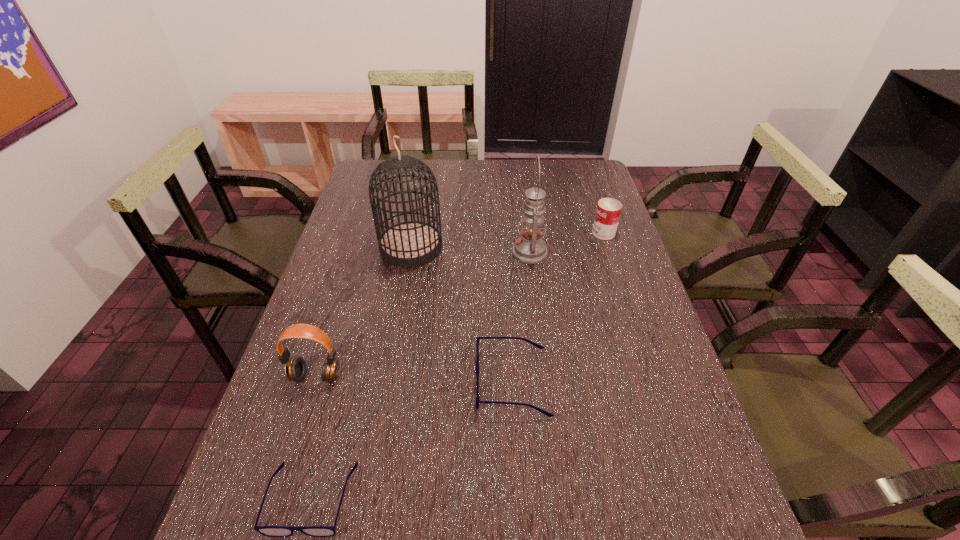
Find the location of a particular element. This screenshot has width=960, height=540. free space between the nearest object and the birdcage is located at coordinates (362, 373).

Find the location of `unoccupied area between the oil lamp and the birdcage`. unoccupied area between the oil lamp and the birdcage is located at coordinates (470, 249).

This screenshot has width=960, height=540. In order to click on unoccupied area between the headset and the oil lamp in this screenshot , I will do click(422, 314).

Identify the location of free space that is in between the can and the oil lamp. Image resolution: width=960 pixels, height=540 pixels. (566, 242).

At what (x,y) coordinates should I click in order to perform the action: click on vacant area that lies between the fourth tallest object and the nearer spectacles. Please return your answer as a coordinate pair (x, y). Looking at the image, I should click on (458, 366).

You are a GUI agent. You are given a task and a screenshot of the screen. Output one action in this format:
    pyautogui.click(x=<x>, y=<y>)
    Task: Click on the free space between the right spectacles and the oil lamp
    The height and width of the screenshot is (540, 960).
    Given the screenshot: What is the action you would take?
    pyautogui.click(x=521, y=317)

Image resolution: width=960 pixels, height=540 pixels. I want to click on vacant area that lies between the fourth shortest object and the second shortest object, so click(x=414, y=379).

Identify the location of vacant region between the second shortest object and the shorter spectacles. (412, 441).

You are a GUI agent. You are given a task and a screenshot of the screen. Output one action in this format:
    pyautogui.click(x=<x>, y=<y>)
    Task: Click on the empty space that is in between the rightmost object and the birdcage
    The image size is (960, 540).
    Given the screenshot: What is the action you would take?
    pyautogui.click(x=507, y=240)

Locate an element on the screen. This screenshot has height=540, width=960. free space between the oil lamp and the left spectacles is located at coordinates (420, 375).